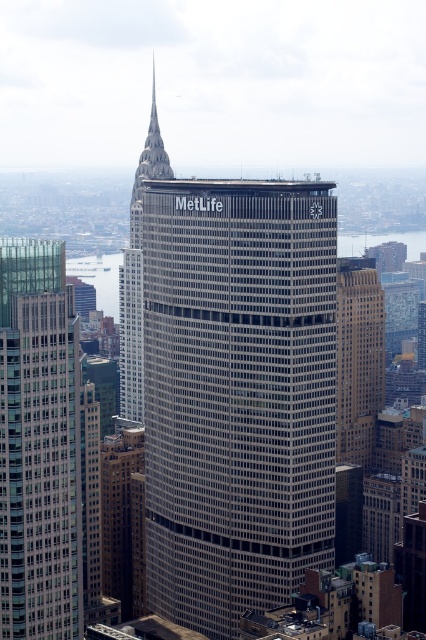
You are an architect evaluating the urban layout. Based on the image, which building is wider between the glassy reflective skyscraper at left and the brown stone building at center?

The glassy reflective skyscraper at left is wider than the brown stone building at center.

You are an architect analyzing the urban layout. From your vantage point, which structure would block the view of the glassy reflective skyscraper at left if you were standing closer to the gray glass building at center?

The gray glass building at center is in front of the glassy reflective skyscraper at left, so standing closer to it would block the view of the glassy reflective skyscraper at left.

You are a city planner analyzing the skyline. The MetLife building has a rectangular shape with a grid of windows. Where is the gray glass building at center located in the image coordinates?

The gray glass building at center is located at coordinates point (236,394).